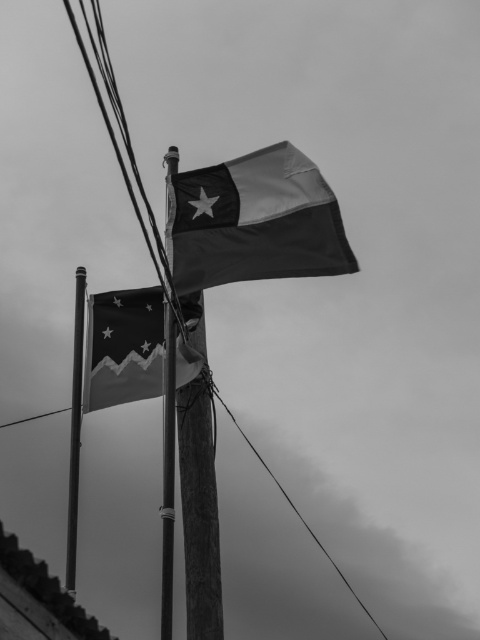
You are standing in front of two flagpoles. You see a wooden pole at center and a smooth wire at center. Which one is positioned to the left?

The wooden pole at center is positioned to the left of the smooth wire at center.

Based on the photo, you are a photographer setting up a tripod to capture both the smooth metal pole at left and the smooth wire at center. Since you want to ensure both are fully visible in your shot, which object should you position closer to the front of the frame?

The smooth metal pole at left has a lesser height compared to the smooth wire at center, so you should position the smooth metal pole at left closer to the front of the frame to ensure both are fully visible.